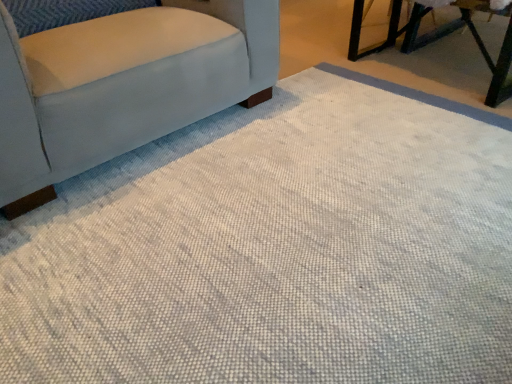
Question: Does point (501, 84) appear closer or farther from the camera than point (55, 180)?

Choices:
 (A) farther
 (B) closer

Answer: (A)

Question: Do you think metallic green table at upper right is within light gray fabric chair at left, or outside of it?

Choices:
 (A) inside
 (B) outside

Answer: (B)

Question: In the image, is metallic green table at upper right positioned in front of or behind light gray fabric chair at left?

Choices:
 (A) front
 (B) behind

Answer: (B)

Question: From the image's perspective, is light gray fabric chair at left located above or below metallic green table at upper right?

Choices:
 (A) below
 (B) above

Answer: (A)

Question: From a real-world perspective, relative to metallic green table at upper right, is light gray fabric chair at left vertically above or below?

Choices:
 (A) below
 (B) above

Answer: (B)

Question: Relative to metallic green table at upper right, is light gray fabric chair at left in front or behind?

Choices:
 (A) front
 (B) behind

Answer: (A)

Question: Does point (144, 26) appear closer or farther from the camera than point (352, 57)?

Choices:
 (A) farther
 (B) closer

Answer: (B)